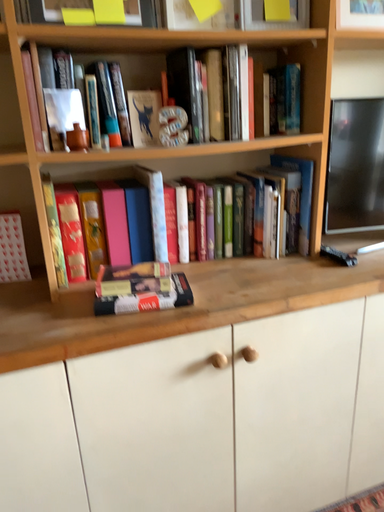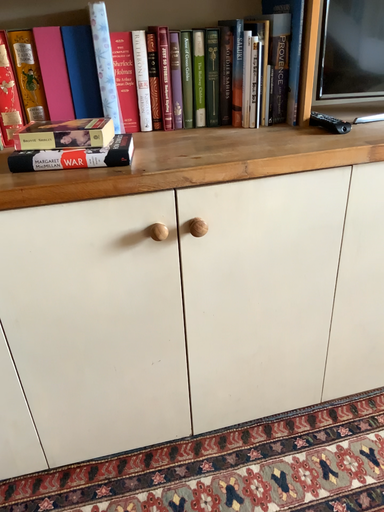
Question: How did the camera likely rotate when shooting the video?

Choices:
 (A) rotated downward
 (B) rotated upward

Answer: (A)